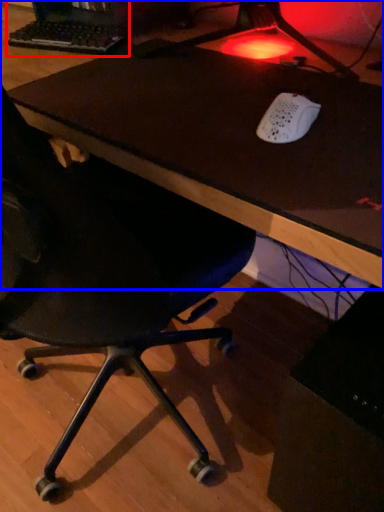
Question: Among these objects, which one is farthest to the camera, desktop computer (highlighted by a red box) or table (highlighted by a blue box)?

Choices:
 (A) desktop computer
 (B) table

Answer: (A)